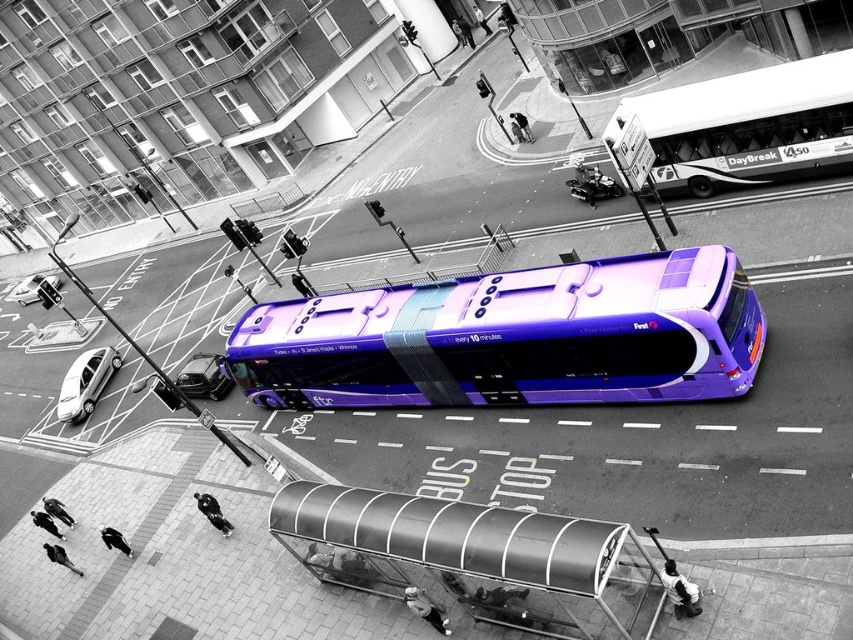
Is point (508, 401) more distant than point (656, 120)?

No, it is in front of (656, 120).

Is purple glossy bus at center above white glossy bus at upper right?

No.

Is point (581, 307) positioned before point (804, 122)?

Yes.

The image size is (853, 640). I want to click on purple glossy bus at center, so click(512, 337).

Which is in front, point (67, 390) or point (190, 396)?

Point (190, 396) is in front.

Who is lower down, silver metallic sedan at lower left or shiny black car at lower left?

silver metallic sedan at lower left

Is point (93, 404) farther from camera compared to point (189, 360)?

Yes, it is.

Identify the location of silver metallic sedan at lower left. The image size is (853, 640). (85, 381).

Which is in front, point (604, 612) or point (589, 193)?

Point (604, 612) is more forward.

Can you confirm if metallic silver bus stop at lower center is positioned to the left of metallic silver scooter at center?

Indeed, metallic silver bus stop at lower center is positioned on the left side of metallic silver scooter at center.

Which is in front, point (592, 541) or point (589, 196)?

Point (592, 541)

Identify the location of metallic silver bus stop at lower center. (474, 557).